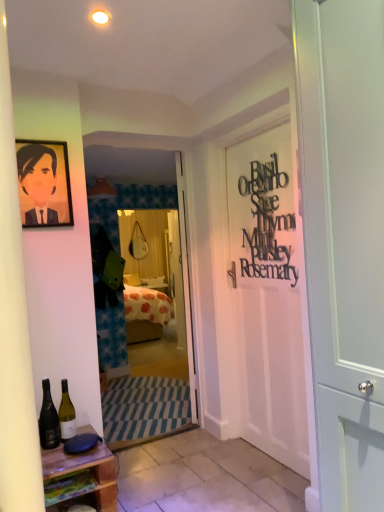
Identify the location of free region on the left part of white wooden door at center, the second door positioned from the right. The image size is (384, 512). (142, 411).